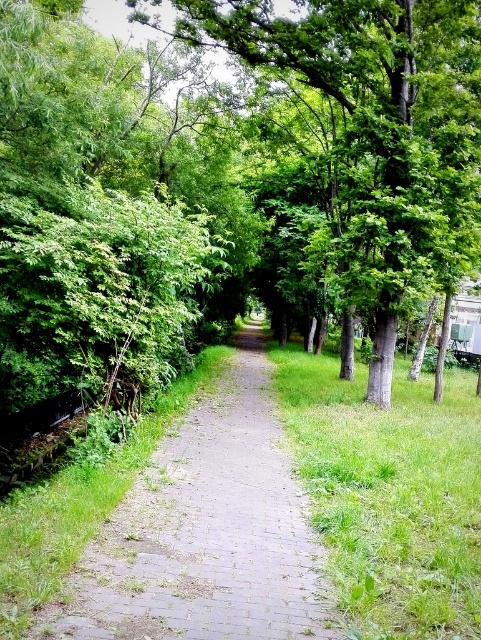
You are a hiker walking along the gray brick path at center and want to reach a clearing beyond the green leafy tree at center. Is the path visible beyond the tree?

The gray brick path at center is behind the green leafy tree at center, so the path is visible beyond the tree.

You are a gardener who needs to determine the relative sizes of the green leafy tree at center and the gray brick path at center in the image. Which one appears larger?

The green leafy tree at center appears larger than the gray brick path at center.

You are a hiker standing at the start of the path and want to know which object is taller between the green leafy tree at center and the gray brick path at center. Can you tell me?

The green leafy tree at center is taller than the gray brick path at center.